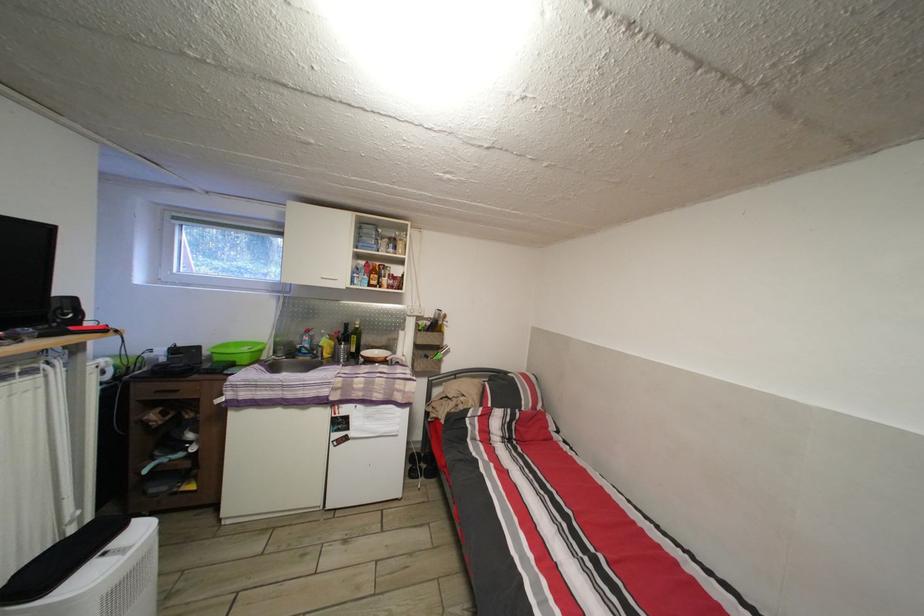
Identify the location of yellow plastic bottle. This screenshot has width=924, height=616. click(x=326, y=346).